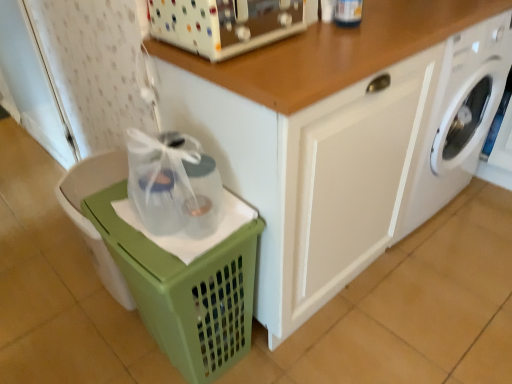
Question: Is green plastic basket at lower left completely or partially outside of white glossy cabinet at center?

Choices:
 (A) no
 (B) yes

Answer: (B)

Question: From a real-world perspective, is green plastic basket at lower left positioned over white glossy cabinet at center based on gravity?

Choices:
 (A) no
 (B) yes

Answer: (A)

Question: From the image's perspective, does green plastic basket at lower left appear lower than white glossy cabinet at center?

Choices:
 (A) no
 (B) yes

Answer: (B)

Question: From a real-world perspective, is green plastic basket at lower left physically below white glossy cabinet at center?

Choices:
 (A) no
 (B) yes

Answer: (B)

Question: Is there a large distance between green plastic basket at lower left and white glossy cabinet at center?

Choices:
 (A) yes
 (B) no

Answer: (B)

Question: Is the depth of green plastic basket at lower left greater than that of white glossy cabinet at center?

Choices:
 (A) yes
 (B) no

Answer: (A)

Question: Is white textured screen door at left outside of white plastic toaster at upper center?

Choices:
 (A) yes
 (B) no

Answer: (A)

Question: Is white plastic toaster at upper center a part of white textured screen door at left?

Choices:
 (A) no
 (B) yes

Answer: (A)

Question: Can you confirm if white textured screen door at left is smaller than white plastic toaster at upper center?

Choices:
 (A) no
 (B) yes

Answer: (A)

Question: Is white textured screen door at left beside white plastic toaster at upper center?

Choices:
 (A) no
 (B) yes

Answer: (A)

Question: Is white textured screen door at left wider than white plastic toaster at upper center?

Choices:
 (A) yes
 (B) no

Answer: (B)

Question: From a real-world perspective, is white textured screen door at left on top of white plastic toaster at upper center?

Choices:
 (A) yes
 (B) no

Answer: (B)

Question: Does white glossy washing machine at lower right come in front of white glossy cabinet at center?

Choices:
 (A) no
 (B) yes

Answer: (A)